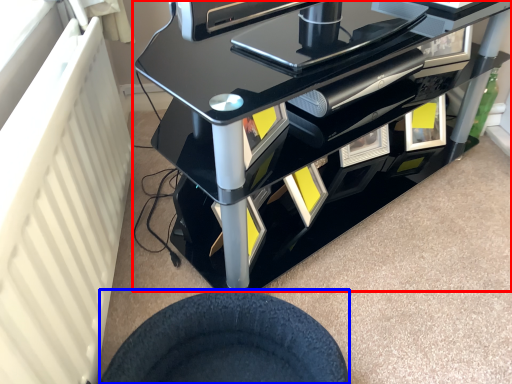
Question: Which point is further to the camera, furniture (highlighted by a red box) or wheel (highlighted by a blue box)?

Choices:
 (A) furniture
 (B) wheel

Answer: (A)